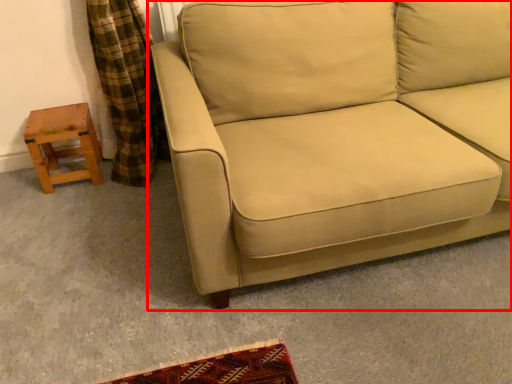
Question: In this image, where is studio couch (annotated by the red box) located relative to stool?

Choices:
 (A) right
 (B) left

Answer: (A)